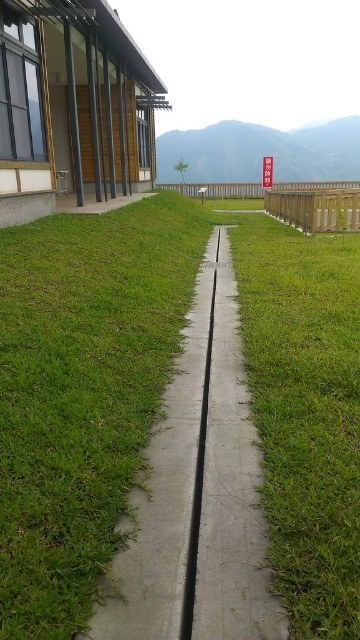
Question: Is the position of concrete at center more distant than that of wooden fence at right?

Choices:
 (A) no
 (B) yes

Answer: (A)

Question: Can you confirm if concrete at center is positioned above wooden fence at right?

Choices:
 (A) yes
 (B) no

Answer: (B)

Question: Which point appears farthest from the camera in this image?

Choices:
 (A) (156, 516)
 (B) (339, 221)

Answer: (B)

Question: Is concrete at center positioned behind wooden fence at right?

Choices:
 (A) no
 (B) yes

Answer: (A)